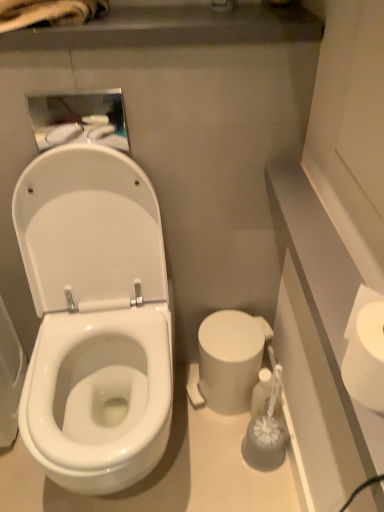
Question: Is white glossy medicine cabinet at upper left surrounded by white matte toilet paper at right?

Choices:
 (A) no
 (B) yes

Answer: (A)

Question: Considering the relative sizes of white matte toilet paper at right and white glossy medicine cabinet at upper left in the image provided, is white matte toilet paper at right shorter than white glossy medicine cabinet at upper left?

Choices:
 (A) yes
 (B) no

Answer: (A)

Question: Is white matte toilet paper at right taller than white glossy medicine cabinet at upper left?

Choices:
 (A) no
 (B) yes

Answer: (A)

Question: From the image's perspective, does white matte toilet paper at right appear lower than white glossy medicine cabinet at upper left?

Choices:
 (A) yes
 (B) no

Answer: (A)

Question: Is white matte toilet paper at right oriented away from white glossy medicine cabinet at upper left?

Choices:
 (A) yes
 (B) no

Answer: (B)

Question: From the image's perspective, is white glossy medicine cabinet at upper left positioned above or below translucent plastic brush at lower right?

Choices:
 (A) below
 (B) above

Answer: (B)

Question: In terms of height, does white glossy medicine cabinet at upper left look taller or shorter compared to translucent plastic brush at lower right?

Choices:
 (A) short
 (B) tall

Answer: (A)

Question: From a real-world perspective, relative to translucent plastic brush at lower right, is white glossy medicine cabinet at upper left vertically above or below?

Choices:
 (A) above
 (B) below

Answer: (A)

Question: Is point (87, 140) positioned closer to the camera than point (266, 394)?

Choices:
 (A) farther
 (B) closer

Answer: (B)

Question: Relative to white glossy toilet at left, is white matte toilet paper at right in front or behind?

Choices:
 (A) front
 (B) behind

Answer: (A)

Question: Considering the positions of white matte toilet paper at right and white glossy toilet at left in the image, is white matte toilet paper at right bigger or smaller than white glossy toilet at left?

Choices:
 (A) small
 (B) big

Answer: (A)

Question: Is white matte toilet paper at right to the left or to the right of white glossy toilet at left in the image?

Choices:
 (A) left
 (B) right

Answer: (B)

Question: From a real-world perspective, is white matte toilet paper at right above or below white glossy toilet at left?

Choices:
 (A) below
 (B) above

Answer: (B)

Question: From the image's perspective, is white glossy toilet at left located above or below white glossy medicine cabinet at upper left?

Choices:
 (A) above
 (B) below

Answer: (B)

Question: From their relative heights in the image, would you say white glossy toilet at left is taller or shorter than white glossy medicine cabinet at upper left?

Choices:
 (A) tall
 (B) short

Answer: (A)